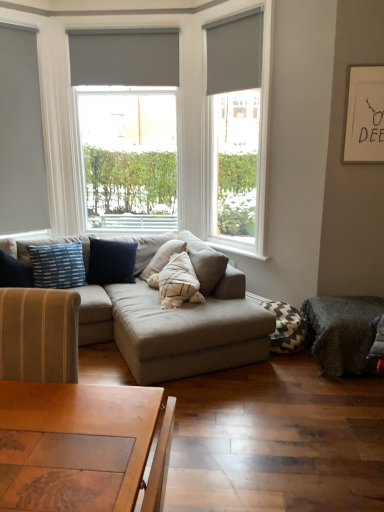
Locate an element on the screen. Image resolution: width=384 pixels, height=512 pixels. free point above matte gray blind at upper right, placed as the first blind when sorted from front to back (from a real-world perspective) is located at coordinates (231, 15).